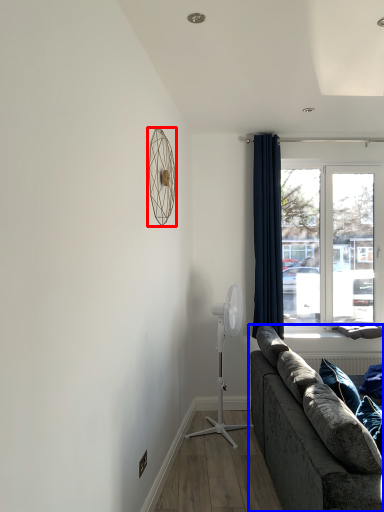
Question: Which object appears closest to the camera in this image, mechanical fan (highlighted by a red box) or studio couch (highlighted by a blue box)?

Choices:
 (A) mechanical fan
 (B) studio couch

Answer: (B)